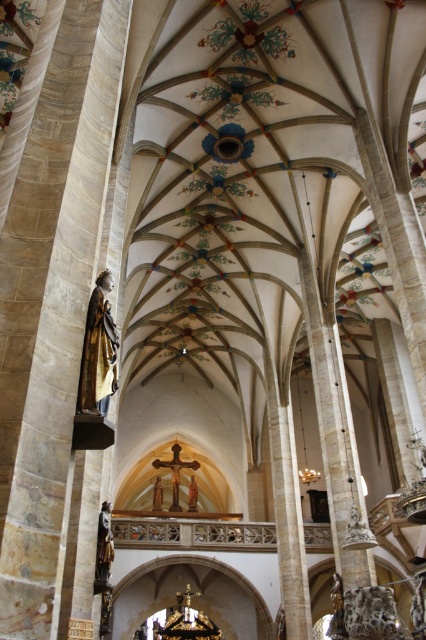
You are an art conservator tasked with measuring the statues in the church. Which statue has a greater width between the polished bronze statue at left and the polished bronze statue at lower left?

The polished bronze statue at left has a greater width than the polished bronze statue at lower left according to the description.

You are standing in the grand Gothic church and want to take a closer look at both the polished bronze statue at left and the polished bronze statue at lower left. Which statue should you move towards first to get closer to the one that is nearer to you?

The polished bronze statue at left is closer to the viewer than the polished bronze statue at lower left, so you should move towards the polished bronze statue at left first to get closer to the one that is nearer to you.